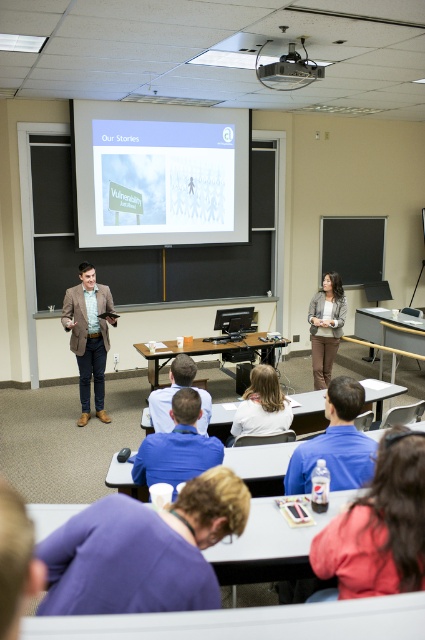
You are a student sitting in the classroom and want to adjust your shirt to avoid being seen by the projector. Since the projector is at upper center, where should you position your purple fabric shirt at lower center relative to the matte black projector at upper center?

The purple fabric shirt at lower center is located below the matte black projector at upper center, so positioning it directly under the projector would keep it out of the projected light.

You are a photographer standing at the back of the classroom. You want to take a photo of both the pink fabric shirt at lower right and the blue fabric shirt at center so that both shirts are clearly visible. Which shirt should you focus on first to ensure proper focus?

The pink fabric shirt at lower right has a lesser height compared to blue fabric shirt at center. To ensure both shirts are clearly visible, focus on the blue fabric shirt at center first since it is taller and will require more precise focusing to capture details.

You are standing in the classroom and want to locate the blue matte projection screen at upper center. What are the coordinates where you can find it?

The blue matte projection screen at upper center is located at coordinates point (159, 173).